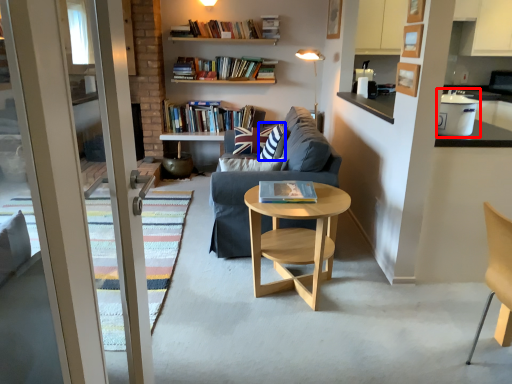
Question: Which object appears farthest to the camera in this image, appliance (highlighted by a red box) or pillow (highlighted by a blue box)?

Choices:
 (A) appliance
 (B) pillow

Answer: (B)